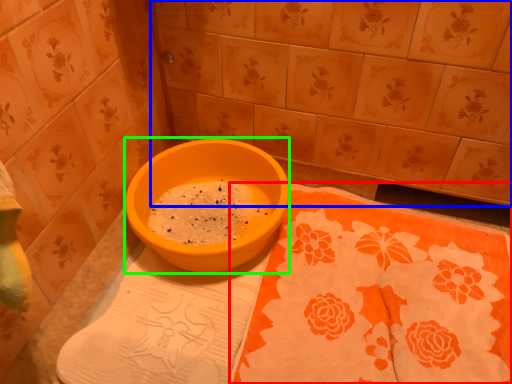
Question: Considering the real-world distances, which object is farthest from tablecloth (highlighted by a red box)? ceramic tile (highlighted by a blue box) or basin (highlighted by a green box)?

Choices:
 (A) ceramic tile
 (B) basin

Answer: (A)